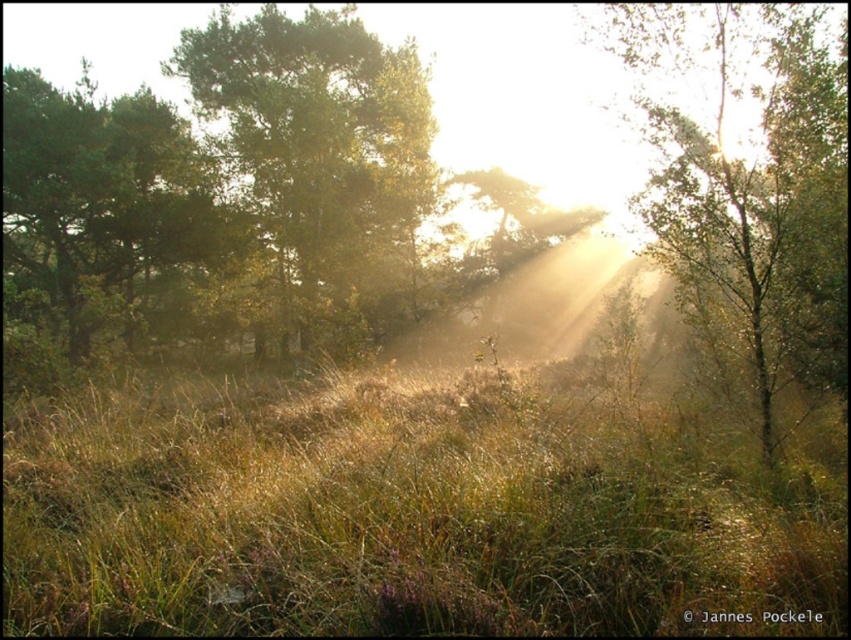
Question: From the image, what is the correct spatial relationship of green leafy tree at center in relation to green matte tree at center?

Choices:
 (A) right
 (B) left

Answer: (A)

Question: Among these points, which one is farthest from the camera?

Choices:
 (A) (370, 246)
 (B) (467, 490)
 (C) (769, 13)
 (D) (121, 140)

Answer: (A)

Question: Which object appears farthest from the camera in this image?

Choices:
 (A) green grassy at center
 (B) green matte tree at center

Answer: (B)

Question: Does green leafy tree at center appear on the right side of green matte tree at left?

Choices:
 (A) yes
 (B) no

Answer: (A)

Question: Is green grassy at center wider than green leafy tree at center?

Choices:
 (A) yes
 (B) no

Answer: (B)

Question: Which point appears farthest from the camera in this image?

Choices:
 (A) (175, 593)
 (B) (829, 336)

Answer: (B)